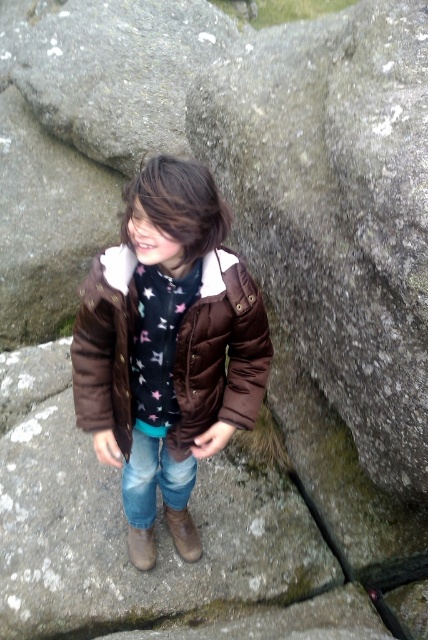
You are a photographer trying to capture a closeup shot of the gray rough rock at center. You are currently standing 6 feet away from it. Can you get closer than 5 feet to take the photo?

The gray rough rock at center and camera are 6.03 feet apart from each other, so you cannot get closer than 5 feet to take the photo since you are already at 6.03 feet away.